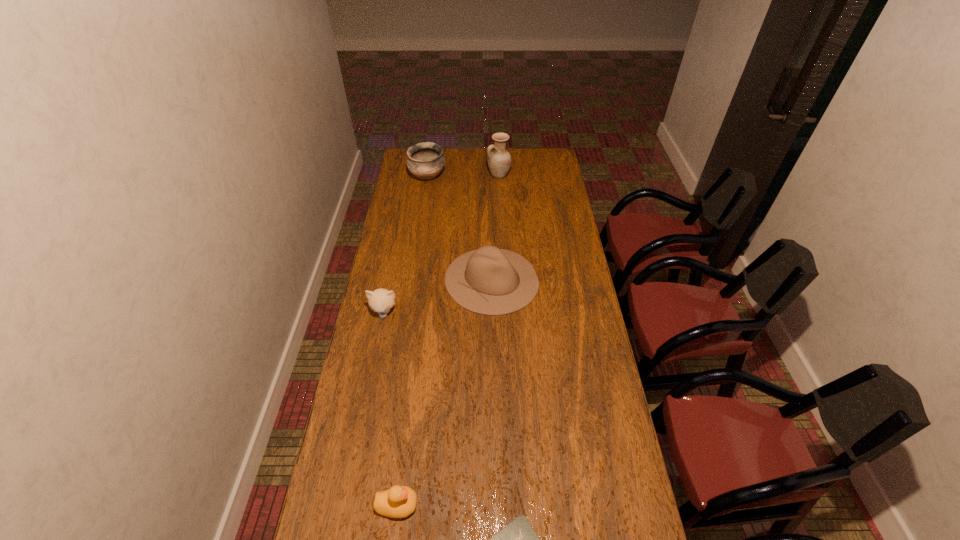
In order to click on free spot between the duck and the shorter pottery in this screenshot , I will do point(413,341).

The height and width of the screenshot is (540, 960). In order to click on unoccupied area between the duck and the shorter pottery in this screenshot , I will do `click(413, 341)`.

Image resolution: width=960 pixels, height=540 pixels. What are the coordinates of `vacant space that is in between the tallest object and the fifth tallest object` in the screenshot? It's located at (448, 340).

Choose which object is the fifth nearest neighbor to the taller pottery. Please provide its 2D coordinates. Your answer should be formatted as a tuple, i.e. [(x, y)], where the tuple contains the x and y coordinates of a point satisfying the conditions above.

[(518, 539)]

This screenshot has height=540, width=960. Find the location of `the fourth closest object to the tallest object`. the fourth closest object to the tallest object is located at coordinates pyautogui.click(x=399, y=501).

You are a GUI agent. You are given a task and a screenshot of the screen. Output one action in this format:
    pyautogui.click(x=<x>, y=<y>)
    Task: Click on the vacant space that satisfies the following two spatial constraints: 1. on the front side of the taller pottery; 2. on the face of the duck
    
    Given the screenshot: What is the action you would take?
    pyautogui.click(x=516, y=505)

Where is `free space that satisfies the following two spatial constraints: 1. on the back side of the taller pottery; 2. on the right side of the sombrero`? The width and height of the screenshot is (960, 540). free space that satisfies the following two spatial constraints: 1. on the back side of the taller pottery; 2. on the right side of the sombrero is located at coordinates (489, 175).